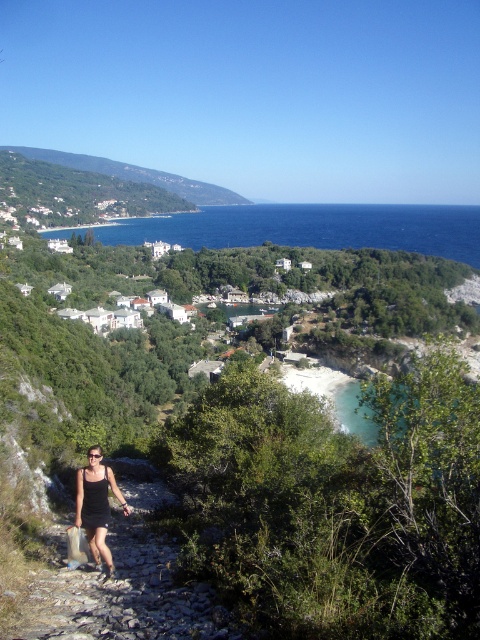
You are standing at the point marked as point (162, 540) in the coastal landscape image. You want to walk to the rocky path leading towards the settlement. Is the path closer to you or farther away than 50 meters?

The point marked as point (162, 540) is 45.69 meters away from you, so the path is closer than 50 meters.

You are standing at the rocky path and want to reach the blue water at center. Which direction should you move relative to the black fabric dress at lower left?

To reach the blue water at center, you should move to the right side of the black fabric dress at lower left since the blue water at center is positioned on the right side of it.